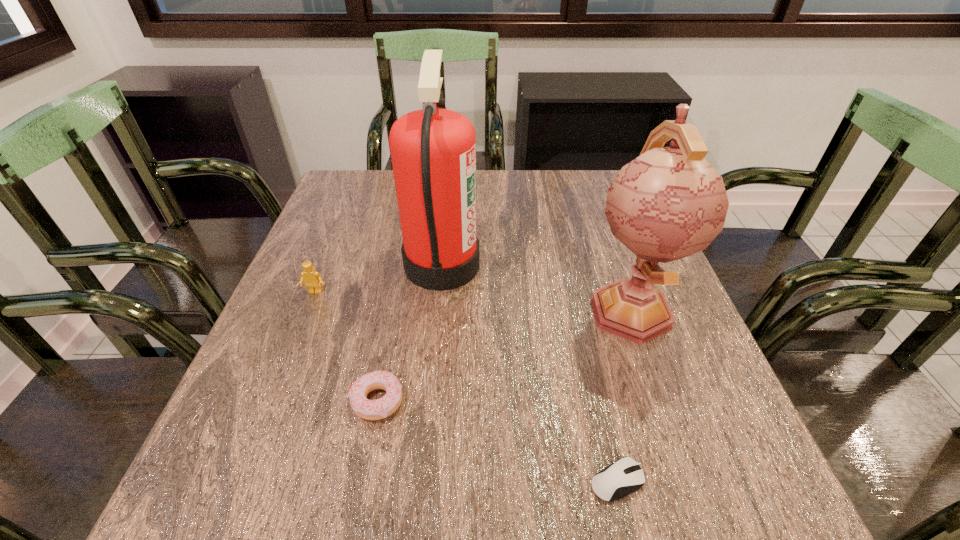
Locate an element on the screen. This screenshot has width=960, height=540. vacant space that is in between the fire extinguisher and the nearest object is located at coordinates (529, 373).

Choose which object is the third nearest neighbor to the nearest object. Please provide its 2D coordinates. Your answer should be formatted as a tuple, i.e. [(x, y)], where the tuple contains the x and y coordinates of a point satisfying the conditions above.

[(433, 151)]

Identify the location of object that can be found as the third closest to the mouse. The image size is (960, 540). (433, 151).

Where is `vacant space that satisfies the following two spatial constraints: 1. at the nozzle of the fire extinguisher; 2. on the face of the Lego`? The height and width of the screenshot is (540, 960). vacant space that satisfies the following two spatial constraints: 1. at the nozzle of the fire extinguisher; 2. on the face of the Lego is located at coordinates (440, 292).

At what (x,y) coordinates should I click in order to perform the action: click on free location that satisfies the following two spatial constraints: 1. on the face of the fourth tallest object; 2. on the left side of the Lego. Please return your answer as a coordinate pair (x, y). This screenshot has height=540, width=960. Looking at the image, I should click on (272, 400).

Locate an element on the screen. This screenshot has height=540, width=960. vacant space that satisfies the following two spatial constraints: 1. at the nozzle of the fire extinguisher; 2. on the right side of the mouse is located at coordinates (420, 481).

Where is `free space that satisfies the following two spatial constraints: 1. on the face of the shortest object; 2. on the right side of the third tallest object`? free space that satisfies the following two spatial constraints: 1. on the face of the shortest object; 2. on the right side of the third tallest object is located at coordinates (240, 481).

Locate an element on the screen. This screenshot has height=540, width=960. vacant space that satisfies the following two spatial constraints: 1. at the nozzle of the fire extinguisher; 2. on the face of the leftmost object is located at coordinates (440, 292).

Find the location of a particular element. free space that satisfies the following two spatial constraints: 1. on the face of the nearest object; 2. on the left side of the leftmost object is located at coordinates (240, 481).

Where is `free space that satisfies the following two spatial constraints: 1. at the nozzle of the fire extinguisher; 2. on the back side of the shortest object`? free space that satisfies the following two spatial constraints: 1. at the nozzle of the fire extinguisher; 2. on the back side of the shortest object is located at coordinates (420, 481).